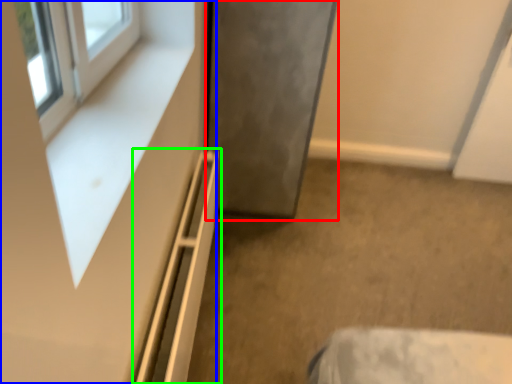
Question: Which object is the farthest from door (highlighted by a red box)? Choose among these: dresser (highlighted by a blue box) or shelf (highlighted by a green box).

Choices:
 (A) dresser
 (B) shelf

Answer: (A)